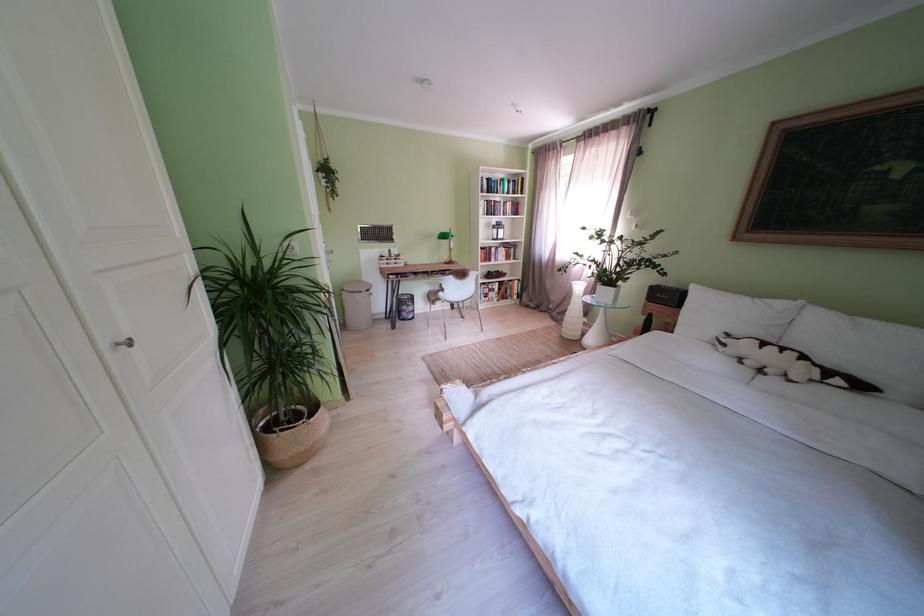
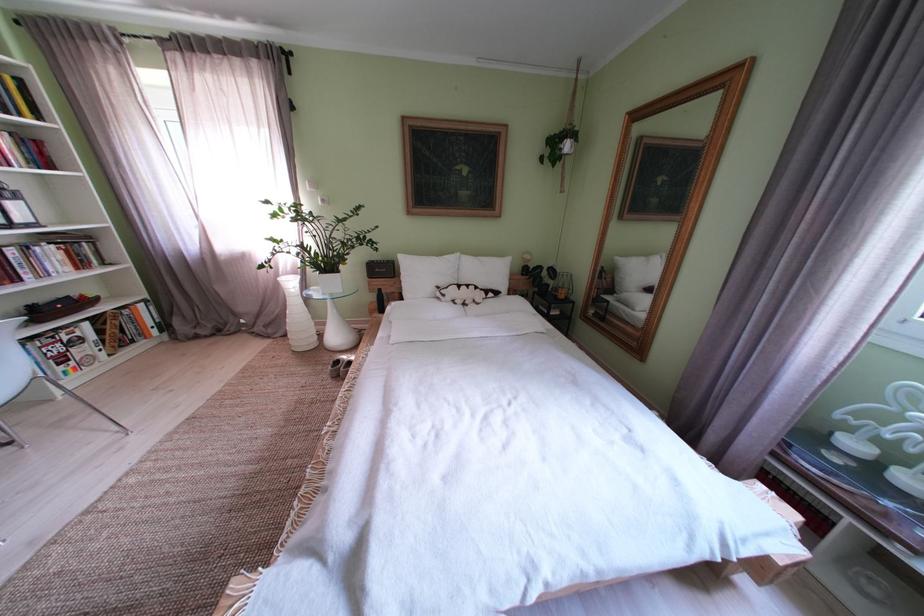
Where in the second image is the point corresponding to pixel 505 294 from the first image?

(92, 344)